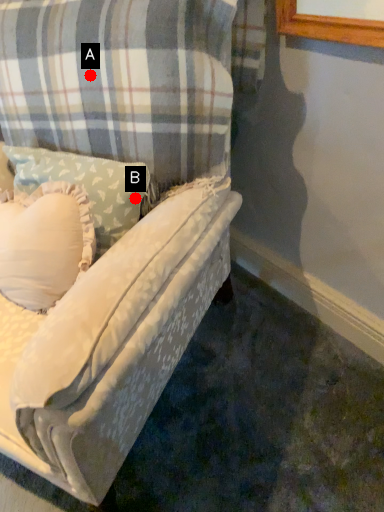
Question: Two points are circled on the image, labeled by A and B beside each circle. Among these points, which one is nearest to the camera?

Choices:
 (A) A is closer
 (B) B is closer

Answer: (A)